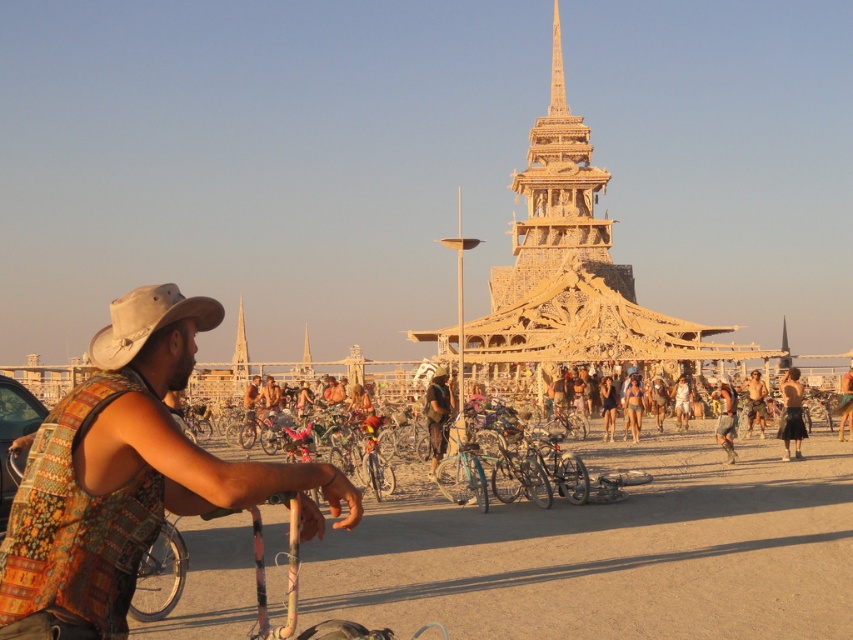
Question: Is tan leather cowboy hat at left further to camera compared to black fabric shorts at center?

Choices:
 (A) no
 (B) yes

Answer: (A)

Question: Considering the relative positions of printed fabric vest at left and black fabric shorts at center in the image provided, where is printed fabric vest at left located with respect to black fabric shorts at center?

Choices:
 (A) above
 (B) below

Answer: (B)

Question: Which object is farther from the camera taking this photo?

Choices:
 (A) printed fabric vest at left
 (B) black fabric shorts at center
 (C) tan leather cowboy hat at left
 (D) beige sand at center

Answer: (B)

Question: Which point appears farthest from the camera in this image?

Choices:
 (A) (32, 454)
 (B) (509, 513)

Answer: (B)

Question: Among these objects, which one is nearest to the camera?

Choices:
 (A) beige sand at center
 (B) rustic wood bicycle at center
 (C) printed fabric vest at left
 (D) tan leather cowboy hat at left

Answer: (C)

Question: Does printed fabric vest at left appear under black fabric shorts at center?

Choices:
 (A) no
 (B) yes

Answer: (B)